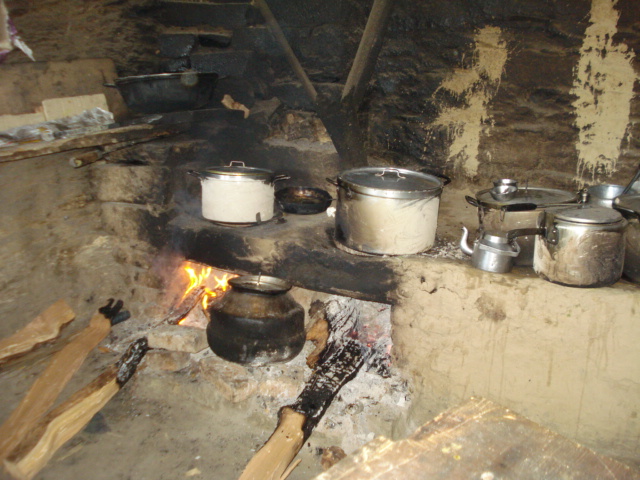
The height and width of the screenshot is (480, 640). Find the location of `white pot`. white pot is located at coordinates (243, 195).